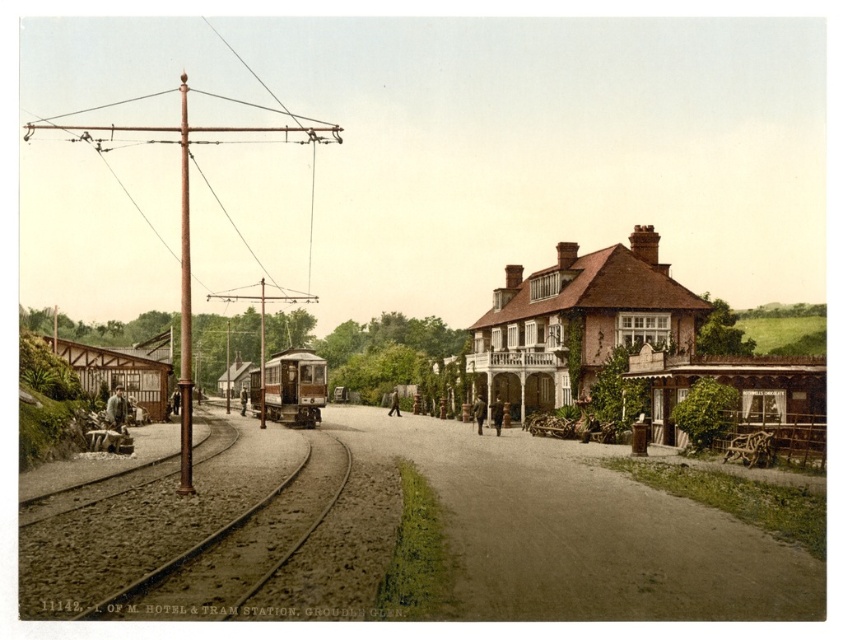
Does point (319, 364) lie in front of point (296, 472)?

That is False.

The width and height of the screenshot is (843, 640). I want to click on polished brass tram at center, so click(288, 387).

Is brown gravel road at center below polished brass tram at center?

Indeed, brown gravel road at center is positioned under polished brass tram at center.

Can you confirm if brown gravel road at center is thinner than polished brass tram at center?

In fact, brown gravel road at center might be wider than polished brass tram at center.

Locate an element on the screen. The image size is (843, 640). brown gravel road at center is located at coordinates (583, 531).

Where is `brown gravel road at center`? The width and height of the screenshot is (843, 640). brown gravel road at center is located at coordinates click(583, 531).

Consider the image. Can you confirm if brown gravel road at center is wider than brown textured building at center right?

Incorrect, brown gravel road at center's width does not surpass brown textured building at center right's.

Where is `brown gravel road at center`? Image resolution: width=843 pixels, height=640 pixels. brown gravel road at center is located at coordinates (583, 531).

Image resolution: width=843 pixels, height=640 pixels. Find the location of `brown gravel road at center`. brown gravel road at center is located at coordinates (583, 531).